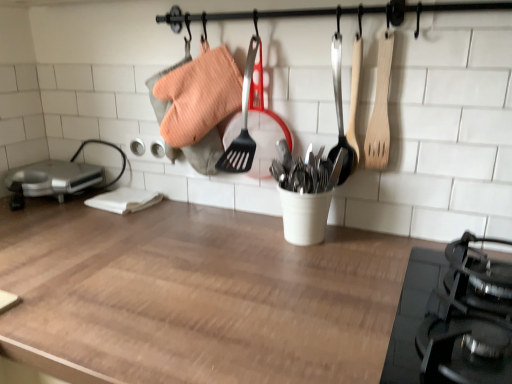
Identify the location of free spot above wooden at center (from a real-world perspective). pyautogui.click(x=201, y=250).